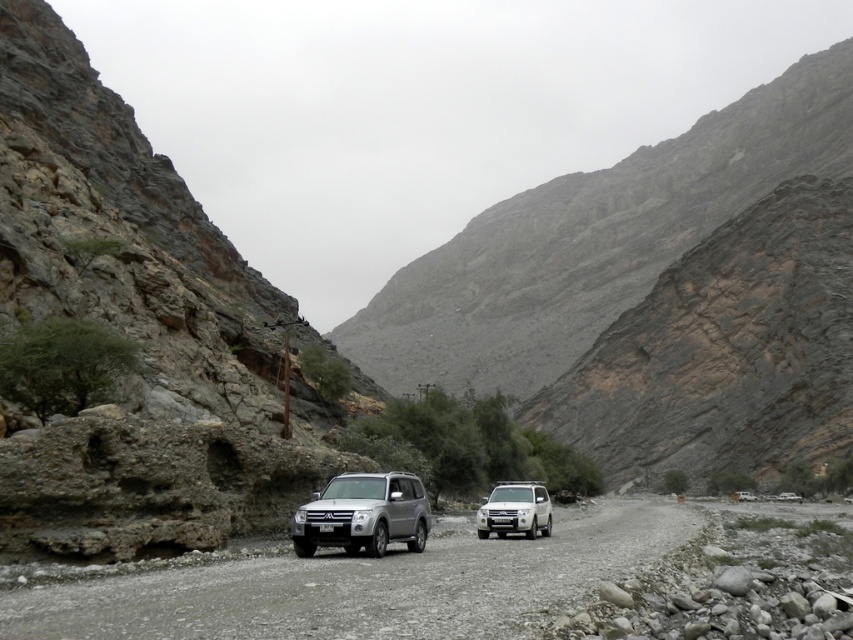
Is silver metallic suv at center shorter than black plastic license plate at center?

In fact, silver metallic suv at center may be taller than black plastic license plate at center.

Does silver metallic suv at center have a larger size compared to black plastic license plate at center?

Yes.

Between point (339, 512) and point (329, 524), which one is positioned in front?

Point (329, 524) is in front.

The image size is (853, 640). In order to click on silver metallic suv at center in this screenshot , I will do `click(363, 515)`.

Between gray gravel road at center and silver metallic suv at center, which one has less height?

Standing shorter between the two is silver metallic suv at center.

Who is more forward, [190,580] or [396,497]?

Point [190,580] is more forward.

Is point (387, 630) positioned behind point (387, 538)?

No, it is in front of (387, 538).

The height and width of the screenshot is (640, 853). What are the coordinates of `gray gravel road at center` in the screenshot? It's located at (364, 586).

Is silver metallic suv at center positioned in front of silver metallic jeep at center?

Yes, silver metallic suv at center is in front of silver metallic jeep at center.

Who is more distant from viewer, (364,524) or (503,536)?

The point (503,536) is more distant.

Who is more forward, (386, 524) or (500, 531)?

→ Positioned in front is point (386, 524).

Where is `silver metallic suv at center`? The width and height of the screenshot is (853, 640). silver metallic suv at center is located at coordinates (363, 515).